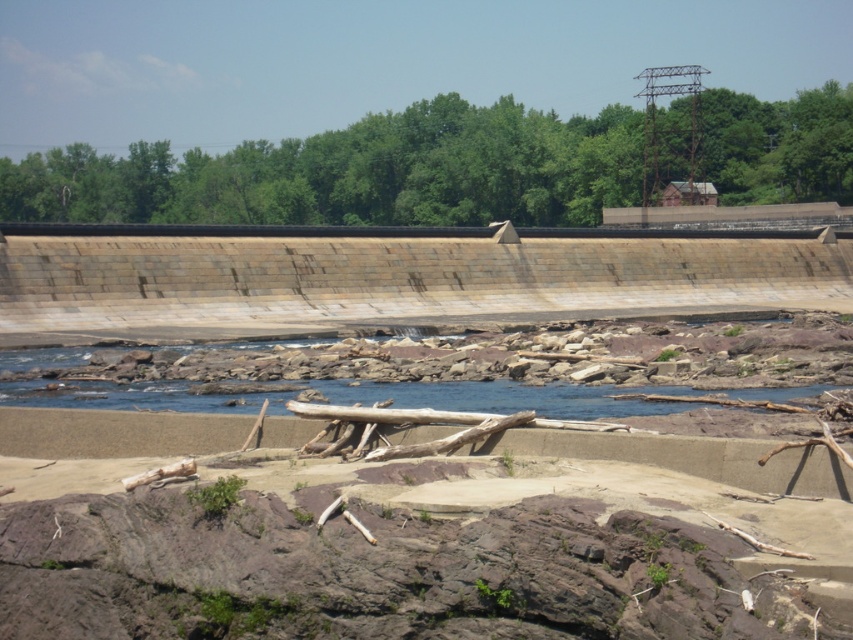
Describe the element at coordinates (395, 275) in the screenshot. The width and height of the screenshot is (853, 640). I see `brown stone dam at center` at that location.

Can you confirm if brown stone dam at center is smaller than clear water at center?

No, brown stone dam at center is not smaller than clear water at center.

Is point (622, 260) closer to viewer compared to point (497, 403)?

That is False.

Where is `brown stone dam at center`? Image resolution: width=853 pixels, height=640 pixels. brown stone dam at center is located at coordinates (395, 275).